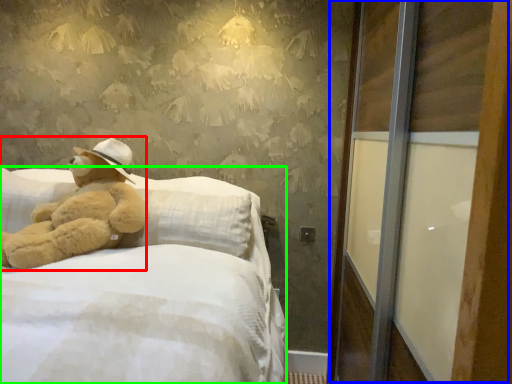
Question: Estimate the real-world distances between objects in this image. Which object is closer to teddy bear (highlighted by a red box), screen door (highlighted by a blue box) or bed (highlighted by a green box)?

Choices:
 (A) screen door
 (B) bed

Answer: (B)